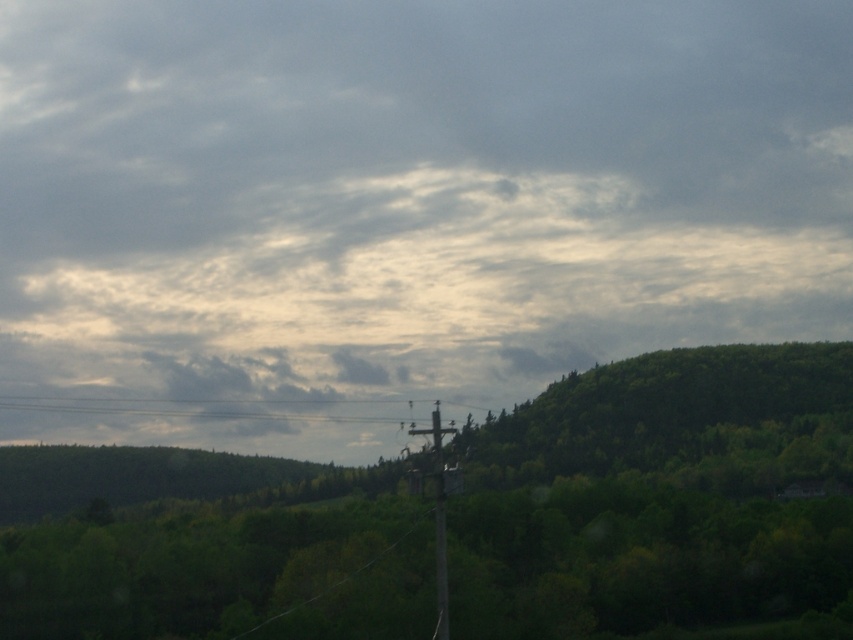
You are a bird flying over the forest scene. You want to land on the highest point between the green leafy tree at center and the black wire at center. Which one should you choose?

The green leafy tree at center has a greater height compared to the black wire at center, so you should choose the green leafy tree at center to land on the highest point.

You are a bird flying over a forest and see the black wire at center and the brown wooden telegraph pole at center. If you want to land on the closest object to the pole, which one should you choose?

The black wire at center is only 1038.54 feet away from the brown wooden telegraph pole at center, so you should land on the black wire at center.

You are a bird flying over the forest and want to land on the power line. The power line is represented by the point at coordinates point [213,406]. Can you land on it?

The power line is represented by the point at coordinates point [213,406], so yes, you can land on it.